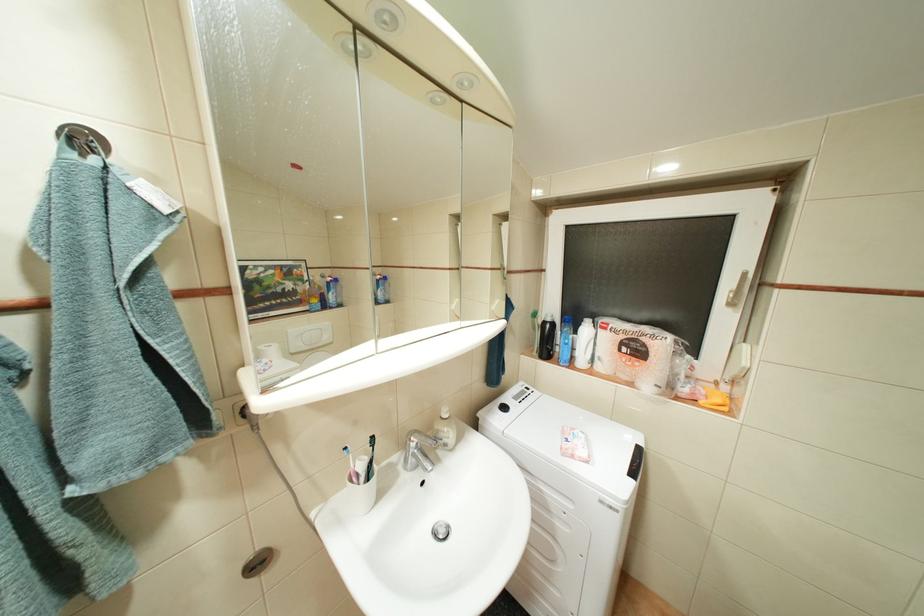
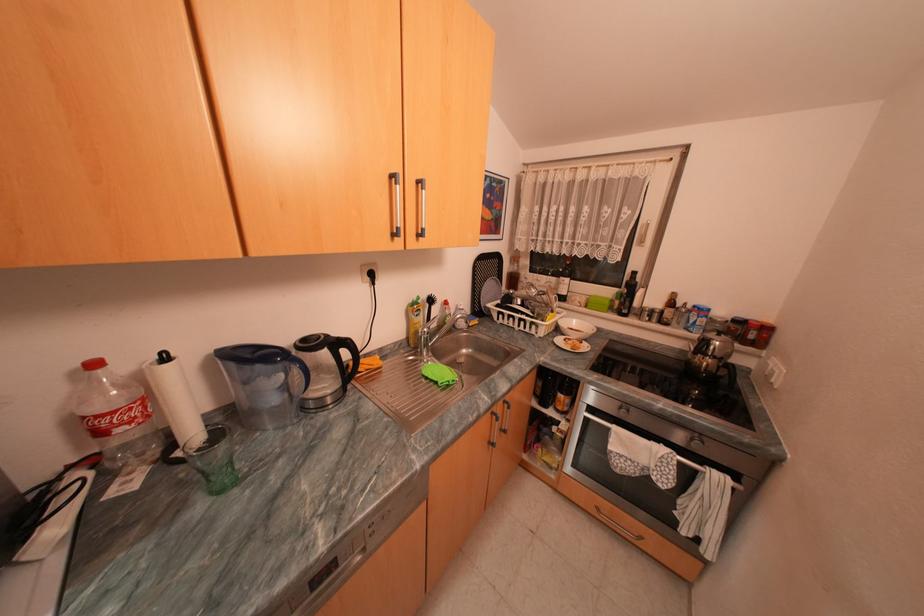
The images are taken continuously from a first-person perspective. In which direction are you moving?

The cameraman walked toward right, backward.